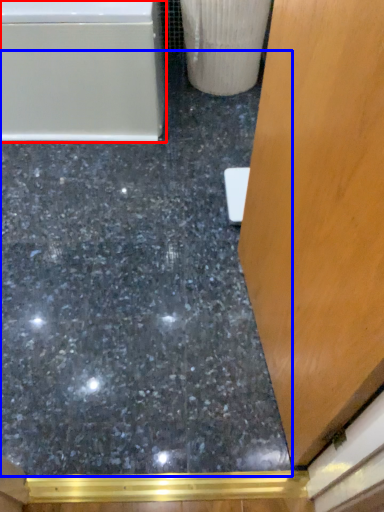
Question: Which point is further to the camera, bathtub (highlighted by a red box) or concrete (highlighted by a blue box)?

Choices:
 (A) bathtub
 (B) concrete

Answer: (A)